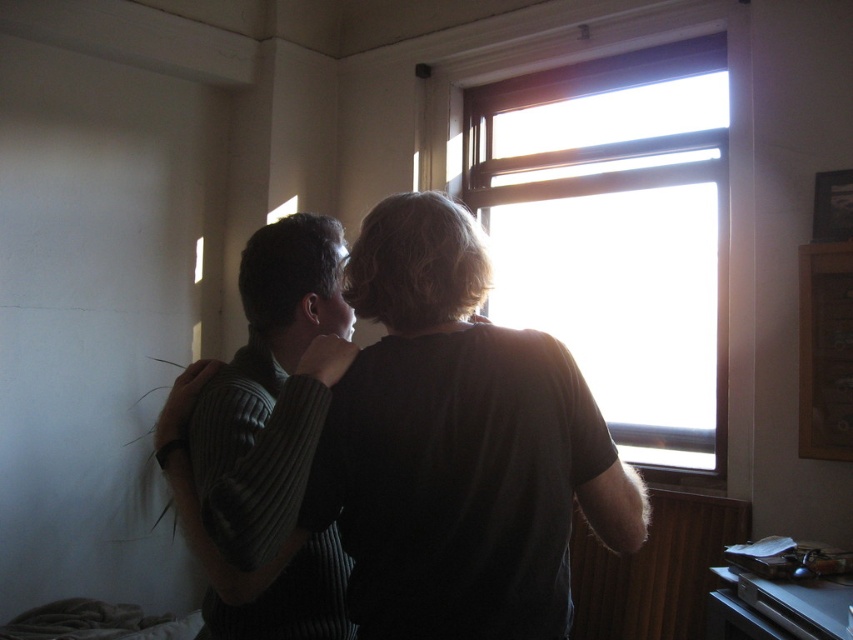
Question: Does dark gray sweater at center appear over transparent glass window at upper center?

Choices:
 (A) no
 (B) yes

Answer: (A)

Question: Which is nearer to the dark gray sweater at center?

Choices:
 (A) ribbed sweater at center
 (B) transparent glass window at upper center

Answer: (A)

Question: Which object appears farthest from the camera in this image?

Choices:
 (A) transparent glass window at upper center
 (B) ribbed sweater at center
 (C) dark gray sweater at center

Answer: (A)

Question: Considering the relative positions of dark gray sweater at center and ribbed sweater at center in the image provided, where is dark gray sweater at center located with respect to ribbed sweater at center?

Choices:
 (A) right
 (B) left

Answer: (A)

Question: Does transparent glass window at upper center appear on the left side of ribbed sweater at center?

Choices:
 (A) no
 (B) yes

Answer: (A)

Question: Which of the following is the farthest from the observer?

Choices:
 (A) transparent glass window at upper center
 (B) ribbed sweater at center

Answer: (A)